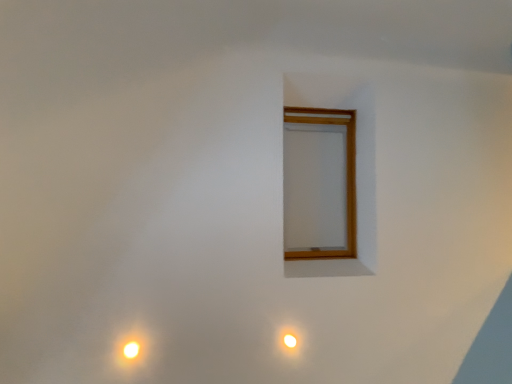
The height and width of the screenshot is (384, 512). What do you see at coordinates (290, 341) in the screenshot?
I see `matte white light at lower center` at bounding box center [290, 341].

Identify the location of matte white light at lower center. (290, 341).

This screenshot has height=384, width=512. What are the coordinates of `matte white light at lower center` in the screenshot? It's located at (290, 341).